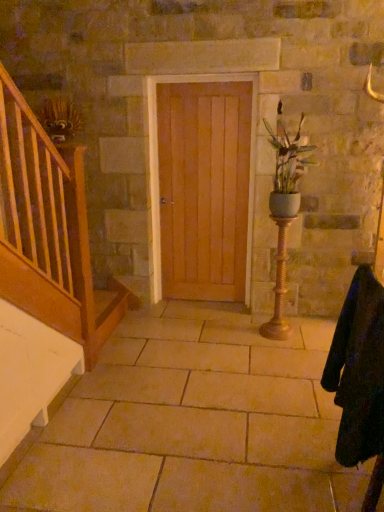
Question: Considering the relative sizes of black woolen robe at lower right and light brown wood door at center in the image provided, is black woolen robe at lower right thinner than light brown wood door at center?

Choices:
 (A) yes
 (B) no

Answer: (B)

Question: Is black woolen robe at lower right to the left of light brown wood door at center from the viewer's perspective?

Choices:
 (A) no
 (B) yes

Answer: (A)

Question: Is black woolen robe at lower right to the right of light brown wood door at center from the viewer's perspective?

Choices:
 (A) yes
 (B) no

Answer: (A)

Question: Are black woolen robe at lower right and light brown wood door at center making contact?

Choices:
 (A) yes
 (B) no

Answer: (B)

Question: Can you confirm if black woolen robe at lower right is shorter than light brown wood door at center?

Choices:
 (A) yes
 (B) no

Answer: (A)

Question: Could light brown wood door at center be considered to be inside black woolen robe at lower right?

Choices:
 (A) yes
 (B) no

Answer: (B)

Question: From a real-world perspective, is light brown wood door at center positioned over gold textured candle holder at center right based on gravity?

Choices:
 (A) yes
 (B) no

Answer: (A)

Question: Is light brown wood door at center looking in the opposite direction of gold textured candle holder at center right?

Choices:
 (A) yes
 (B) no

Answer: (B)

Question: Considering the relative sizes of light brown wood door at center and gold textured candle holder at center right in the image provided, is light brown wood door at center thinner than gold textured candle holder at center right?

Choices:
 (A) yes
 (B) no

Answer: (A)

Question: Can you confirm if light brown wood door at center is shorter than gold textured candle holder at center right?

Choices:
 (A) yes
 (B) no

Answer: (B)

Question: Does light brown wood door at center have a greater height compared to gold textured candle holder at center right?

Choices:
 (A) no
 (B) yes

Answer: (B)

Question: Does light brown wood door at center have a greater width compared to gold textured candle holder at center right?

Choices:
 (A) no
 (B) yes

Answer: (A)

Question: Can you confirm if beige stone floor at center is wider than matte white vase at center right?

Choices:
 (A) no
 (B) yes

Answer: (B)